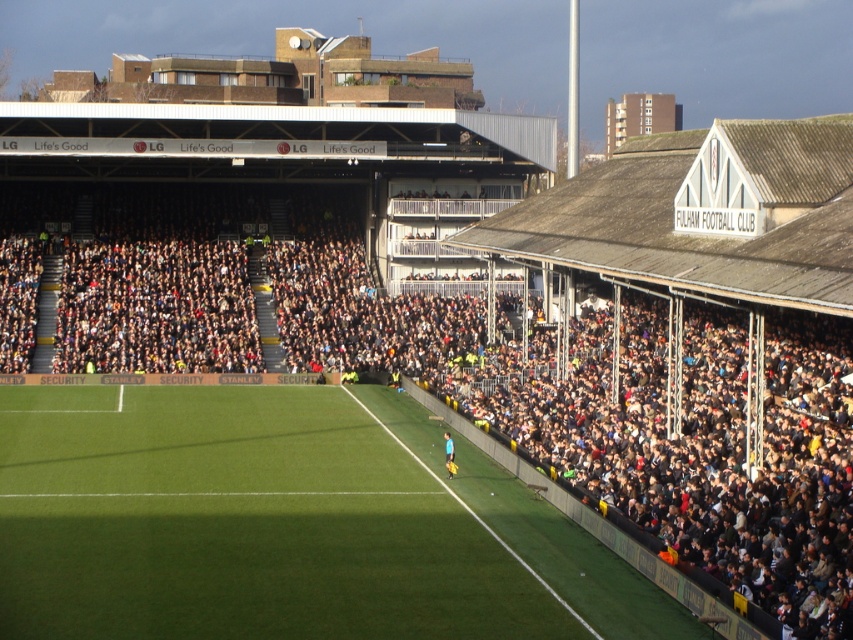
Question: Estimate the real-world distances between objects in this image. Which object is closer to the green artificial turf at center?

Choices:
 (A) yellow jersey at center
 (B) dark gray concrete stadium at upper center

Answer: (A)

Question: Which object is the farthest from the dark gray concrete stadium at upper center?

Choices:
 (A) yellow jersey at center
 (B) green artificial turf at center

Answer: (A)

Question: Where is dark gray concrete stadium at upper center located in relation to green artificial turf at center in the image?

Choices:
 (A) right
 (B) left

Answer: (A)

Question: Can you confirm if dark gray concrete stadium at upper center is bigger than green artificial turf at center?

Choices:
 (A) no
 (B) yes

Answer: (B)

Question: Does dark gray concrete stadium at upper center appear on the right side of green artificial turf at center?

Choices:
 (A) yes
 (B) no

Answer: (A)

Question: Which is farther from the green artificial turf at center?

Choices:
 (A) yellow jersey at center
 (B) dark gray concrete stadium at upper center

Answer: (B)